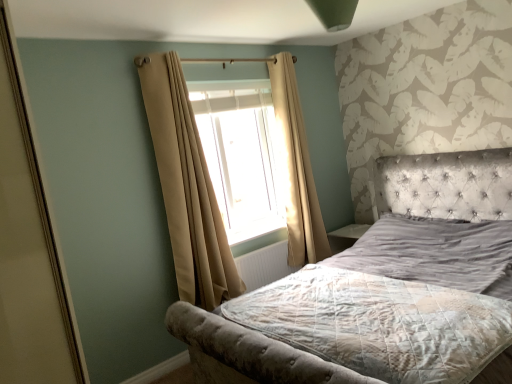
Question: In which direction should I rotate to look at beige fabric curtain at center, which is counted as the first curtain, starting from the back?

Choices:
 (A) left
 (B) right

Answer: (B)

Question: Can you confirm if translucent fabric window at center is shorter than beige fabric curtain at left, which is counted as the 2th curtain, starting from the back?

Choices:
 (A) yes
 (B) no

Answer: (A)

Question: Does translucent fabric window at center have a smaller size compared to beige fabric curtain at left, which is counted as the 2th curtain, starting from the back?

Choices:
 (A) yes
 (B) no

Answer: (A)

Question: From the image's perspective, would you say translucent fabric window at center is shown under beige fabric curtain at left, which is counted as the 2th curtain, starting from the back?

Choices:
 (A) no
 (B) yes

Answer: (A)

Question: Is translucent fabric window at center bigger than beige fabric curtain at left, which is counted as the 2th curtain, starting from the back?

Choices:
 (A) yes
 (B) no

Answer: (B)

Question: Does translucent fabric window at center come in front of beige fabric curtain at left, which is counted as the 2th curtain, starting from the back?

Choices:
 (A) yes
 (B) no

Answer: (B)

Question: Is beige fabric curtain at left, which is counted as the 2th curtain, starting from the back, completely or partially inside translucent fabric window at center?

Choices:
 (A) no
 (B) yes

Answer: (A)

Question: Does white textured radiator at center have a smaller size compared to velvet grey bed at center?

Choices:
 (A) no
 (B) yes

Answer: (B)

Question: Considering the relative sizes of white textured radiator at center and velvet grey bed at center in the image provided, is white textured radiator at center wider than velvet grey bed at center?

Choices:
 (A) no
 (B) yes

Answer: (A)

Question: Is white textured radiator at center at the left side of velvet grey bed at center?

Choices:
 (A) no
 (B) yes

Answer: (B)

Question: Does white textured radiator at center turn towards velvet grey bed at center?

Choices:
 (A) no
 (B) yes

Answer: (B)

Question: Considering the relative positions of white textured radiator at center and velvet grey bed at center in the image provided, is white textured radiator at center in front of velvet grey bed at center?

Choices:
 (A) no
 (B) yes

Answer: (A)

Question: Is white textured radiator at center completely or partially outside of velvet grey bed at center?

Choices:
 (A) yes
 (B) no

Answer: (A)

Question: Is textured gray mattress at center in contact with translucent fabric window at center?

Choices:
 (A) yes
 (B) no

Answer: (B)